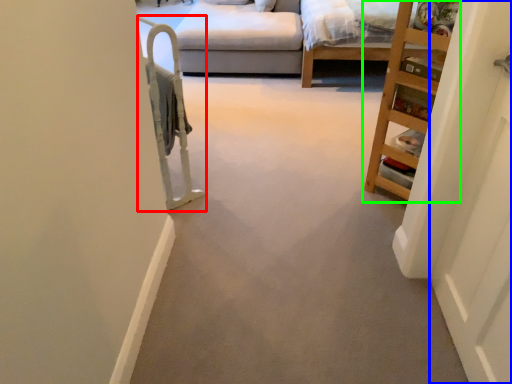
Question: Which is farther away from bunk bed (highlighted by a red box)? door (highlighted by a blue box) or furniture (highlighted by a green box)?

Choices:
 (A) door
 (B) furniture

Answer: (A)